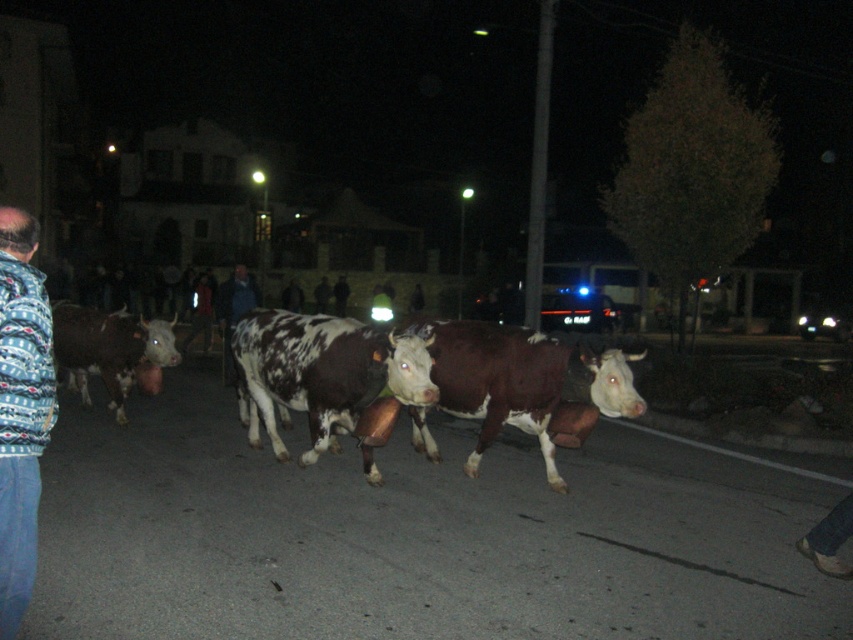
Consider the image. You are a delivery driver who needs to pass through the street where the brown smooth cow at center is located. The GPS shows that the cow is at coordinates point 0.602, 0.618. If your vehicle is 2 meters wide, can you safely navigate around the cow without hitting it?

The brown smooth cow at center is positioned at point (526, 385). However, the exact distance between the cow and the edges of the street or other obstacles isn not provided in the objects description. Without this information, it is impossible to determine if the vehicle can safely navigate around the cow.

You are a delivery person who needs to deliver a package to the address located at point (x=526, y=385). You see a brown smooth cow at center. Can you safely pass by the brown smooth cow at center to reach the address?

The address is located at the point where the brown smooth cow at center is standing, so you cannot safely pass by the brown smooth cow at center to reach the address.

You are a delivery driver who needs to pass through the street where the cows are herded. There is a brushed metal jacket at left and a brown speckled cow at left blocking your path. Can you go around them by moving to the right side of the street?

The brushed metal jacket at left is above the brown speckled cow at left, so the cow is lower in position. Since the cow is blocking the path, you can go around to the right side of the street to pass through.